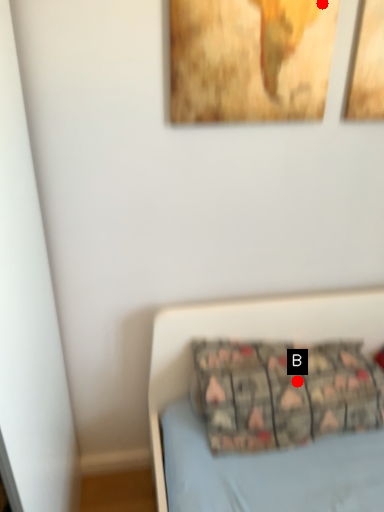
Question: Two points are circled on the image, labeled by A and B beside each circle. Which point is farther from the camera taking this photo?

Choices:
 (A) A is further
 (B) B is further

Answer: (B)